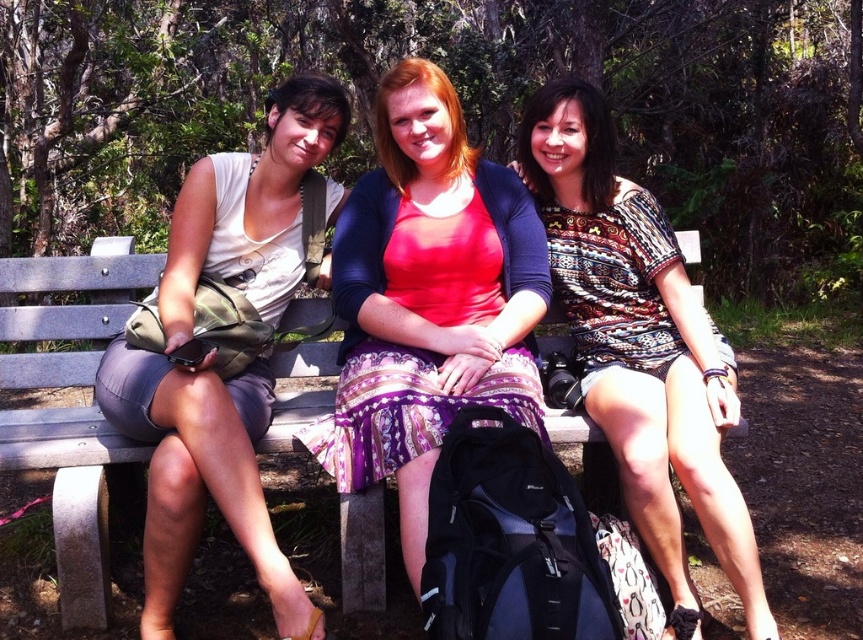
Question: Among these points, which one is nearest to the camera?

Choices:
 (A) pyautogui.click(x=217, y=452)
 (B) pyautogui.click(x=606, y=316)
 (C) pyautogui.click(x=457, y=244)
 (D) pyautogui.click(x=49, y=364)

Answer: (A)

Question: Where is matte white tank top at left located in relation to wooden bench at center in the image?

Choices:
 (A) above
 (B) below

Answer: (A)

Question: Can you confirm if printed cotton dress at center is positioned to the right of wooden bench at center?

Choices:
 (A) no
 (B) yes

Answer: (B)

Question: Is matte pink dress at center positioned at the back of wooden bench at center?

Choices:
 (A) yes
 (B) no

Answer: (B)

Question: Which point appears farthest from the camera in this image?

Choices:
 (A) coord(676,624)
 (B) coord(425,499)
 (C) coord(246,481)
 (D) coord(68,451)

Answer: (D)

Question: Which is farther from the wooden bench at center?

Choices:
 (A) matte pink dress at center
 (B) printed cotton dress at center
 (C) matte white tank top at left

Answer: (B)